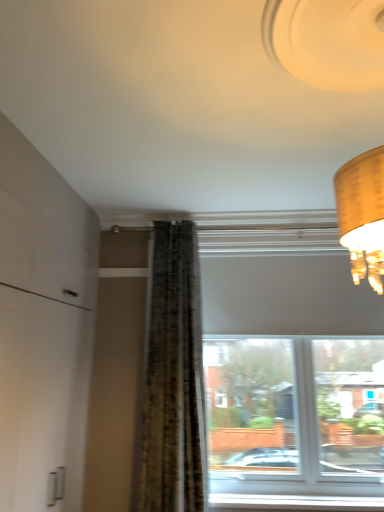
This screenshot has height=512, width=384. Describe the element at coordinates (289, 383) in the screenshot. I see `transparent glass window at upper center` at that location.

In order to face transparent glass window at upper center, should I rotate leftwards or rightwards?

Turn right approximately 13.850 degrees to face it.

At what (x,y) coordinates should I click in order to perform the action: click on transparent glass window at upper center. Please return your answer as a coordinate pair (x, y). Looking at the image, I should click on (289, 383).

Where is `transparent glass window at upper center`? The height and width of the screenshot is (512, 384). transparent glass window at upper center is located at coordinates (289, 383).